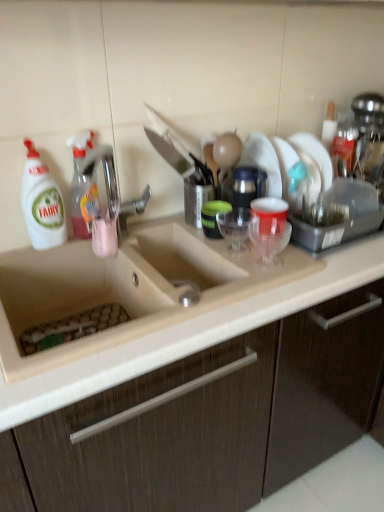
At what (x,y) coordinates should I click in order to perform the action: click on free point in front of transparent plastic cup at center, marked as the 1th tableware in a front-to-back arrangement. Please return your answer as a coordinate pair (x, y). Looking at the image, I should click on (251, 283).